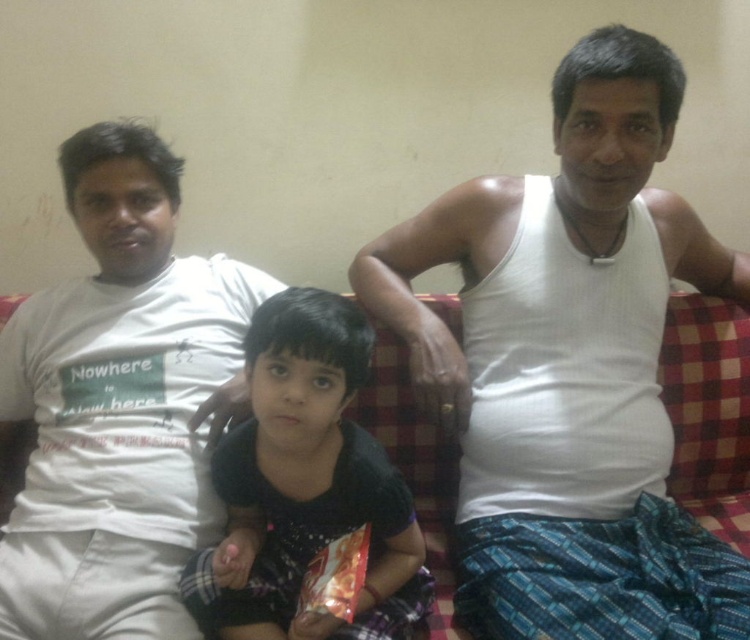
Who is positioned more to the right, white cotton t-shirt at left or dark blue fabric dress at center?

From the viewer's perspective, dark blue fabric dress at center appears more on the right side.

Which of these two, white cotton t-shirt at left or dark blue fabric dress at center, stands shorter?

Standing shorter between the two is dark blue fabric dress at center.

Measure the distance between point (124, 177) and camera.

The distance of point (124, 177) from camera is 1.25 meters.

In order to click on white cotton t-shirt at left in this screenshot , I will do `click(120, 403)`.